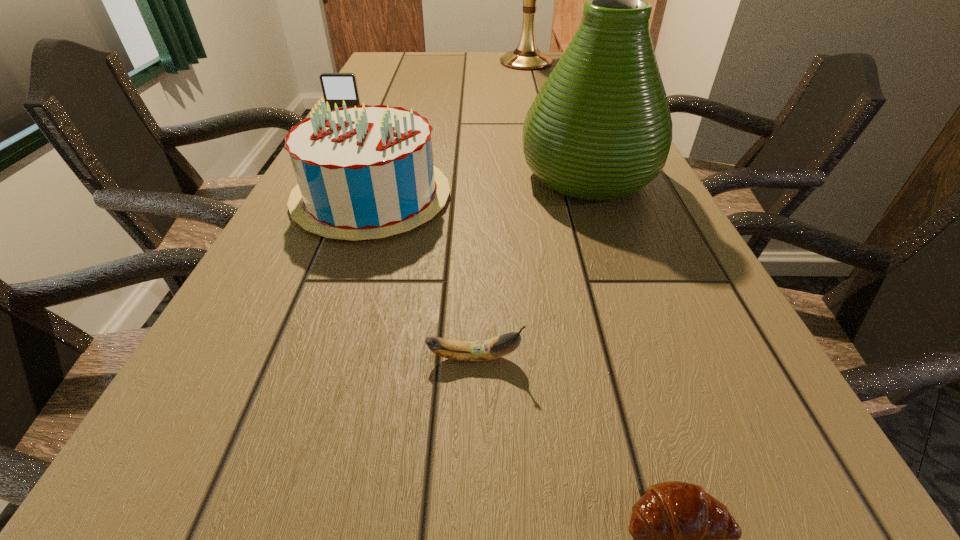
Locate an element on the screen. vacant space that satisfies the following two spatial constraints: 1. on the front-facing side of the fourth shortest object; 2. on the left side of the second farthest object is located at coordinates (314, 197).

Locate an element on the screen. blank area in the image that satisfies the following two spatial constraints: 1. on the front-facing side of the iPod; 2. on the left side of the birthday cake is located at coordinates (314, 197).